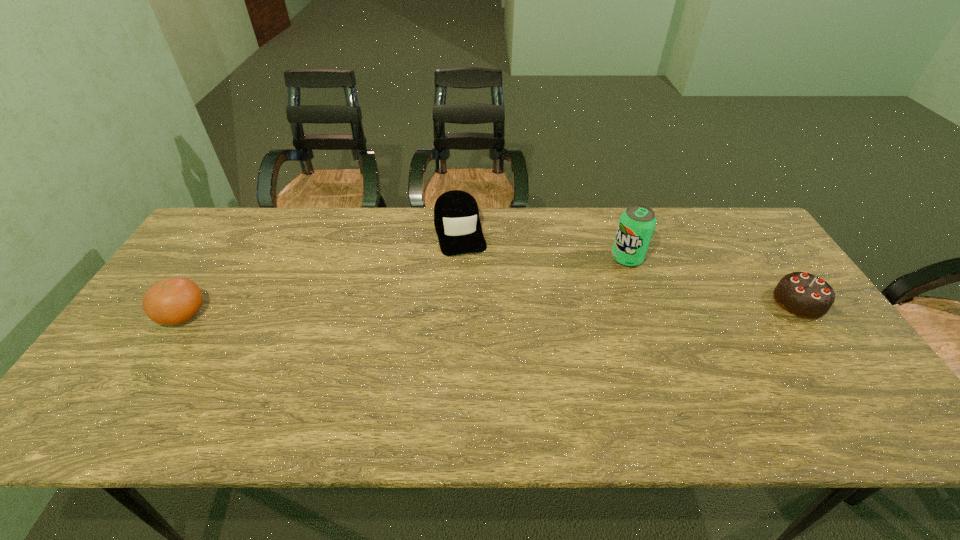
At what (x,y) coordinates should I click in order to perform the action: click on the leftmost object. Please return your answer as a coordinate pair (x, y). This screenshot has height=540, width=960. Looking at the image, I should click on (173, 301).

Where is `the rightmost object`? The height and width of the screenshot is (540, 960). the rightmost object is located at coordinates (804, 295).

Where is `the second object from left to right`? This screenshot has width=960, height=540. the second object from left to right is located at coordinates (456, 215).

This screenshot has width=960, height=540. I want to click on pop soda, so click(637, 223).

Identify the location of the tallest object. (637, 223).

Image resolution: width=960 pixels, height=540 pixels. I want to click on free space located on the right of the leftmost object, so click(226, 314).

You are a GUI agent. You are given a task and a screenshot of the screen. Output one action in this format:
    pyautogui.click(x=<x>, y=<y>)
    Task: Click on the vacant space situated on the back of the rightmost object
    This screenshot has width=960, height=540.
    Given the screenshot: What is the action you would take?
    pyautogui.click(x=763, y=251)

The image size is (960, 540). What are the coordinates of `vacant space located on the front-facing side of the cap` in the screenshot? It's located at (474, 299).

Where is `free space located 0.380m on the front-facing side of the cap`? free space located 0.380m on the front-facing side of the cap is located at coordinates (489, 357).

Identify the location of free space located 0.380m on the front-facing side of the cap. (489, 357).